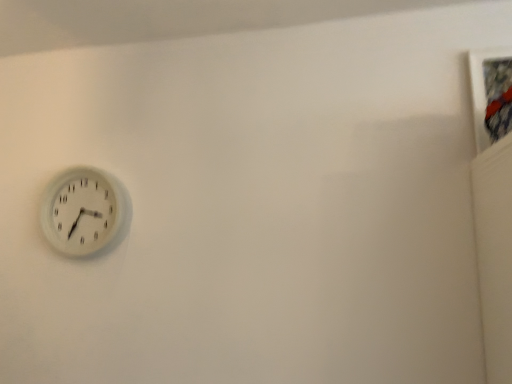
The height and width of the screenshot is (384, 512). What do you see at coordinates (481, 90) in the screenshot? I see `textured fabric picture frame at upper right` at bounding box center [481, 90].

Find the location of a particular element. This screenshot has width=512, height=384. textured fabric picture frame at upper right is located at coordinates (481, 90).

You are a GUI agent. You are given a task and a screenshot of the screen. Output one action in this format:
    pyautogui.click(x=<x>, y=<y>)
    Task: Click on the white plastic wall clock at left
    
    Given the screenshot: What is the action you would take?
    83,211

What do you see at coordinates (83, 211) in the screenshot?
I see `white plastic wall clock at left` at bounding box center [83, 211].

Find the location of a particular element. textured fabric picture frame at upper right is located at coordinates (481, 90).

Between white plastic wall clock at left and textured fabric picture frame at upper right, which one appears on the left side from the viewer's perspective?

From the viewer's perspective, white plastic wall clock at left appears more on the left side.

Based on the photo, between white plastic wall clock at left and textured fabric picture frame at upper right, which one is positioned in front?

textured fabric picture frame at upper right.

Considering the points (59, 196) and (479, 150), which point is behind, point (59, 196) or point (479, 150)?

The point (59, 196) is farther from the camera.

From the image's perspective, is white plastic wall clock at left positioned above or below textured fabric picture frame at upper right?

Based on their image positions, white plastic wall clock at left is located beneath textured fabric picture frame at upper right.

From a real-world perspective, is white plastic wall clock at left located beneath textured fabric picture frame at upper right?

Correct, in the physical world, white plastic wall clock at left is lower than textured fabric picture frame at upper right.

Considering the sizes of white plastic wall clock at left and textured fabric picture frame at upper right in the image, is white plastic wall clock at left wider or thinner than textured fabric picture frame at upper right?

Considering their sizes, white plastic wall clock at left looks slimmer than textured fabric picture frame at upper right.

Can you confirm if white plastic wall clock at left is shorter than textured fabric picture frame at upper right?

No, white plastic wall clock at left is not shorter than textured fabric picture frame at upper right.

Based on their sizes in the image, would you say white plastic wall clock at left is bigger or smaller than textured fabric picture frame at upper right?

white plastic wall clock at left is bigger than textured fabric picture frame at upper right.

Could textured fabric picture frame at upper right be considered to be inside white plastic wall clock at left?

No, white plastic wall clock at left does not contain textured fabric picture frame at upper right.

Is white plastic wall clock at left positioned far away from textured fabric picture frame at upper right?

Yes, white plastic wall clock at left and textured fabric picture frame at upper right are located far from each other.

From the picture: Is textured fabric picture frame at upper right at the back of white plastic wall clock at left?

No, white plastic wall clock at left is not facing away from textured fabric picture frame at upper right.

How many degrees apart are the facing directions of white plastic wall clock at left and textured fabric picture frame at upper right?

The angle between the facing direction of white plastic wall clock at left and the facing direction of textured fabric picture frame at upper right is 0.834 degrees.

You are a GUI agent. You are given a task and a screenshot of the screen. Output one action in this format:
    pyautogui.click(x=<x>, y=<y>)
    Task: Click on the picture frame located on the right of white plastic wall clock at left
    The width and height of the screenshot is (512, 384).
    Given the screenshot: What is the action you would take?
    pyautogui.click(x=481, y=90)

Is textured fabric picture frame at upper right at the right side of white plastic wall clock at left?

Yes.

Which object is more forward, textured fabric picture frame at upper right or white plastic wall clock at left?

Positioned in front is textured fabric picture frame at upper right.

Between point (479, 140) and point (87, 194), which one is positioned behind?

The point (87, 194) is more distant.

From the image's perspective, does textured fabric picture frame at upper right appear lower than white plastic wall clock at left?

No.

From a real-world perspective, is textured fabric picture frame at upper right physically above white plastic wall clock at left?

Yes, from a real-world perspective, textured fabric picture frame at upper right is over white plastic wall clock at left

Based on the photo, which of these two, textured fabric picture frame at upper right or white plastic wall clock at left, is wider?

With larger width is textured fabric picture frame at upper right.

Does textured fabric picture frame at upper right have a lesser height compared to white plastic wall clock at left?

Yes, textured fabric picture frame at upper right is shorter than white plastic wall clock at left.

Which of these two, textured fabric picture frame at upper right or white plastic wall clock at left, is smaller?

textured fabric picture frame at upper right is smaller.

Can we say textured fabric picture frame at upper right lies outside white plastic wall clock at left?

Indeed, textured fabric picture frame at upper right is completely outside white plastic wall clock at left.

Would you say textured fabric picture frame at upper right is a long distance from white plastic wall clock at left?

That's right, there is a large distance between textured fabric picture frame at upper right and white plastic wall clock at left.

Consider the image. Is textured fabric picture frame at upper right aimed at white plastic wall clock at left?

No, textured fabric picture frame at upper right is not oriented towards white plastic wall clock at left.

How far apart are textured fabric picture frame at upper right and white plastic wall clock at left?

1.38 meters.

There is a white plastic wall clock at left. Find the location of `picture frame above it (from a real-world perspective)`. picture frame above it (from a real-world perspective) is located at coordinates (481, 90).

The width and height of the screenshot is (512, 384). I want to click on wall clock on the left of textured fabric picture frame at upper right, so click(x=83, y=211).

Where is `picture frame above the white plastic wall clock at left (from the image's perspective)`? picture frame above the white plastic wall clock at left (from the image's perspective) is located at coordinates (481, 90).